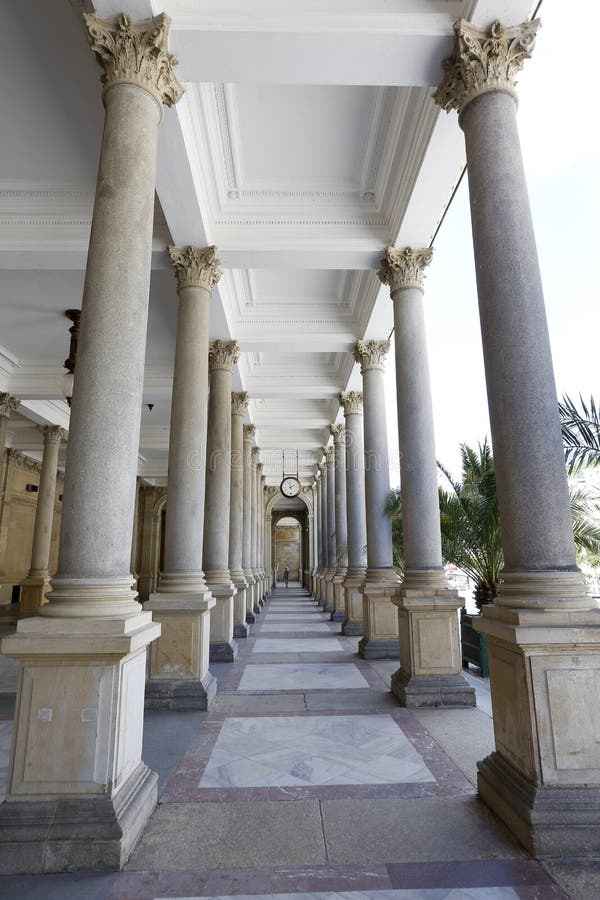
Point to the where the column and the floor connect in the image. Your answer should be formatted as a list of tuples, i.e. [(x1, y1), (x2, y2), ...], where each tuple contains the x and y coordinates of a point satisfying the conditions above.

[(422, 707)]